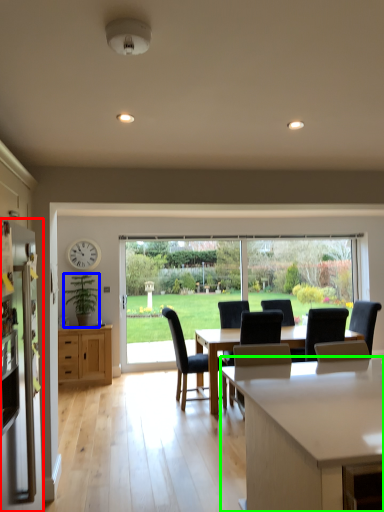
Question: Which object is the farthest from refrigerator (highlighted by a red box)? Choose among these: houseplant (highlighted by a blue box) or countertop (highlighted by a green box).

Choices:
 (A) houseplant
 (B) countertop

Answer: (A)